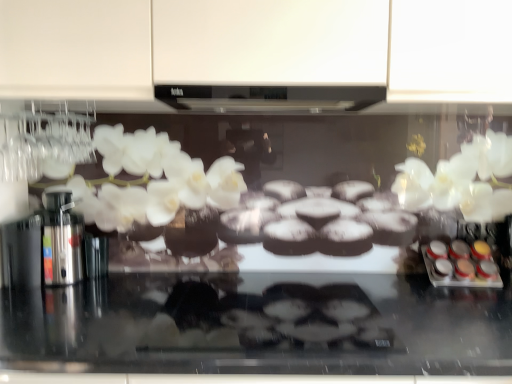
What do you see at coordinates (269, 98) in the screenshot? I see `black matte exhaust hood at center` at bounding box center [269, 98].

You are a GUI agent. You are given a task and a screenshot of the screen. Output one action in this format:
    pyautogui.click(x=<x>, y=<y>)
    Task: Click on the black matte exhaust hood at center
    This screenshot has height=384, width=512.
    Given the screenshot: What is the action you would take?
    pyautogui.click(x=269, y=98)

What do you see at coordinates (459, 265) in the screenshot? I see `metallic silver spice containers at right` at bounding box center [459, 265].

I want to click on metallic silver spice containers at right, so click(459, 265).

Locate an element on the screen. black matte exhaust hood at center is located at coordinates (269, 98).

Is black matte exhaust hood at center to the left or to the right of metallic silver spice containers at right in the image?

Based on their positions, black matte exhaust hood at center is located to the left of metallic silver spice containers at right.

Considering the relative positions of black matte exhaust hood at center and metallic silver spice containers at right in the image provided, is black matte exhaust hood at center in front of metallic silver spice containers at right?

Yes, it is in front of metallic silver spice containers at right.

Is point (273, 111) farther from viewer compared to point (445, 254)?

That is False.

In the scene shown: From the image's perspective, between black matte exhaust hood at center and metallic silver spice containers at right, who is located below?

metallic silver spice containers at right is shown below in the image.

From a real-world perspective, is black matte exhaust hood at center physically located above or below metallic silver spice containers at right?

In terms of real-world spatial position, black matte exhaust hood at center is above metallic silver spice containers at right.

Is black matte exhaust hood at center wider or thinner than metallic silver spice containers at right?

In the image, black matte exhaust hood at center appears to be wider than metallic silver spice containers at right.

Which of these two, black matte exhaust hood at center or metallic silver spice containers at right, stands taller?

metallic silver spice containers at right.

In terms of size, does black matte exhaust hood at center appear bigger or smaller than metallic silver spice containers at right?

black matte exhaust hood at center is bigger than metallic silver spice containers at right.

Looking at this image, could metallic silver spice containers at right be considered to be inside black matte exhaust hood at center?

No, metallic silver spice containers at right is not a part of black matte exhaust hood at center.

In the scene shown: Is black matte exhaust hood at center placed right next to metallic silver spice containers at right?

There is a gap between black matte exhaust hood at center and metallic silver spice containers at right.

Is black matte exhaust hood at center turned away from metallic silver spice containers at right?

No.

You are a GUI agent. You are given a task and a screenshot of the screen. Output one action in this format:
    pyautogui.click(x=<x>, y=<y>)
    Task: Click on the food on the right of black matte exhaust hood at center
    
    Given the screenshot: What is the action you would take?
    pyautogui.click(x=459, y=265)

Between metallic silver spice containers at right and black matte exhaust hood at center, which one appears on the left side from the viewer's perspective?

black matte exhaust hood at center is more to the left.

In the image, is metallic silver spice containers at right positioned in front of or behind black matte exhaust hood at center?

metallic silver spice containers at right is behind black matte exhaust hood at center.

Is point (452, 245) farther from camera compared to point (230, 87)?

That is True.

From the image's perspective, does metallic silver spice containers at right appear lower than black matte exhaust hood at center?

Yes.

From a real-world perspective, is metallic silver spice containers at right positioned above or below black matte exhaust hood at center?

Clearly, from a real-world perspective, metallic silver spice containers at right is below black matte exhaust hood at center.

Between metallic silver spice containers at right and black matte exhaust hood at center, which one has larger width?

With larger width is black matte exhaust hood at center.

Which of these two, metallic silver spice containers at right or black matte exhaust hood at center, stands shorter?

With less height is black matte exhaust hood at center.

Based on the photo, does metallic silver spice containers at right have a smaller size compared to black matte exhaust hood at center?

Indeed, metallic silver spice containers at right has a smaller size compared to black matte exhaust hood at center.

In the scene shown: Is metallic silver spice containers at right not inside black matte exhaust hood at center?

Yes.

Is there a large distance between metallic silver spice containers at right and black matte exhaust hood at center?

Actually, metallic silver spice containers at right and black matte exhaust hood at center are a little close together.

Is metallic silver spice containers at right facing towards black matte exhaust hood at center?

No, metallic silver spice containers at right is not oriented towards black matte exhaust hood at center.

The width and height of the screenshot is (512, 384). I want to click on food lying below the black matte exhaust hood at center (from the image's perspective), so click(x=459, y=265).

You are a GUI agent. You are given a task and a screenshot of the screen. Output one action in this format:
    pyautogui.click(x=<x>, y=<y>)
    Task: Click on the food that appears on the right of black matte exhaust hood at center
    
    Given the screenshot: What is the action you would take?
    pyautogui.click(x=459, y=265)

Image resolution: width=512 pixels, height=384 pixels. In order to click on food that appears below the black matte exhaust hood at center (from the image's perspective) in this screenshot , I will do `click(459, 265)`.